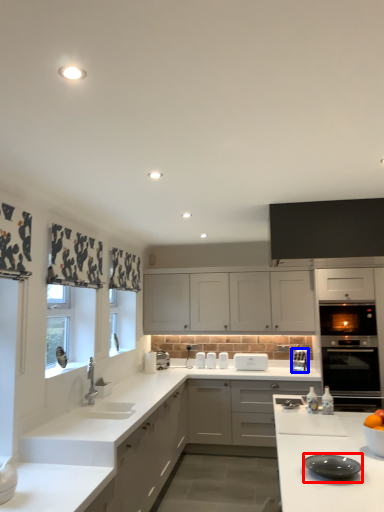
Question: Which of the following is the farthest to the observer, kitchen appliance (highlighted by a red box) or appliance (highlighted by a blue box)?

Choices:
 (A) kitchen appliance
 (B) appliance

Answer: (B)